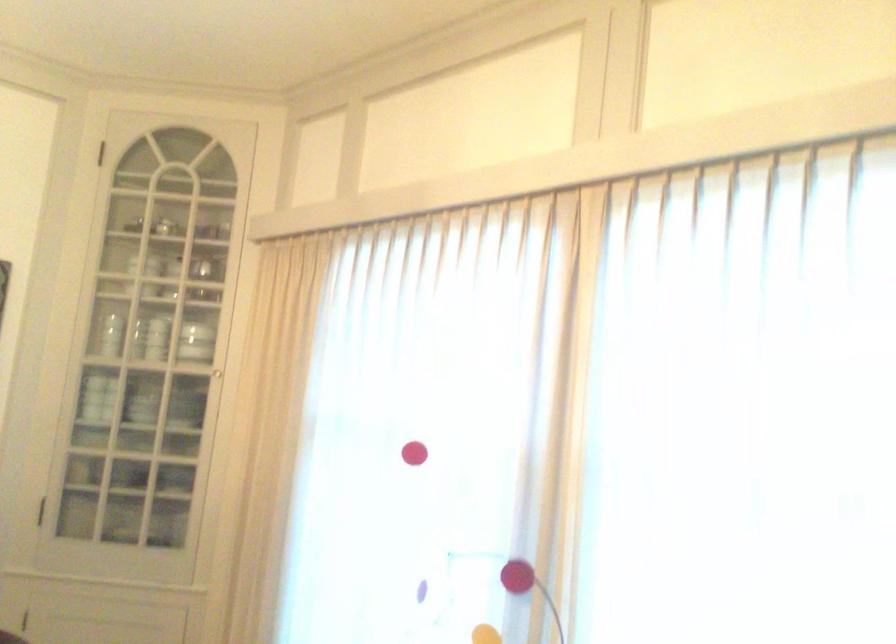
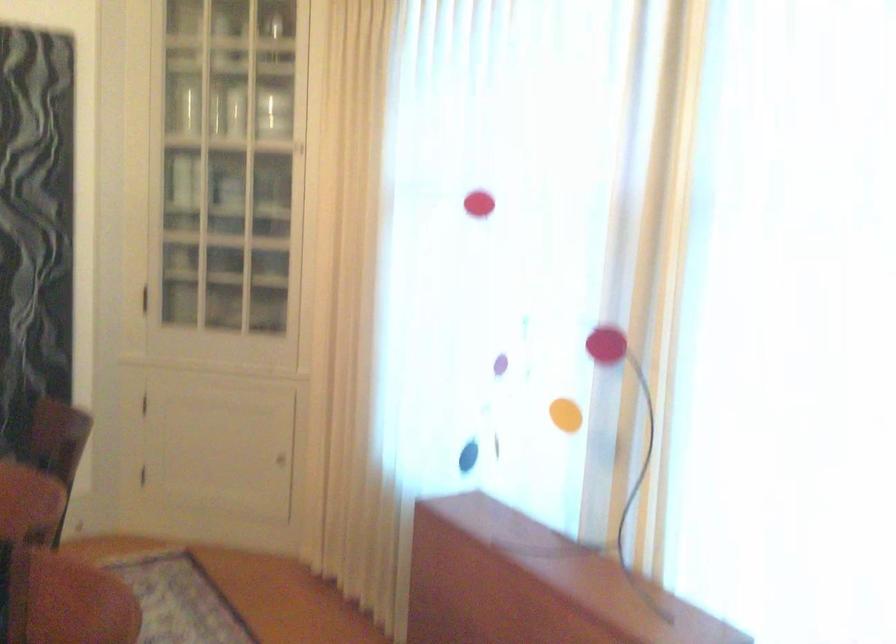
The point at (x=218, y=372) is marked in the first image. Where is the corresponding point in the second image?

(298, 147)